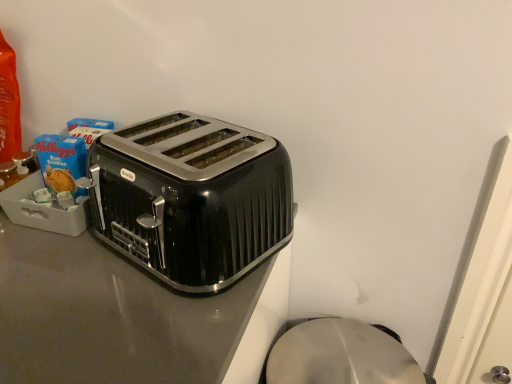
Question: Is black glossy toaster at center surrounding black metallic toaster at center?

Choices:
 (A) yes
 (B) no

Answer: (B)

Question: Is black glossy toaster at center in contact with black metallic toaster at center?

Choices:
 (A) yes
 (B) no

Answer: (B)

Question: Is black glossy toaster at center shorter than black metallic toaster at center?

Choices:
 (A) yes
 (B) no

Answer: (B)

Question: Does black glossy toaster at center come in front of black metallic toaster at center?

Choices:
 (A) yes
 (B) no

Answer: (A)

Question: From a real-world perspective, is black glossy toaster at center positioned under black metallic toaster at center based on gravity?

Choices:
 (A) no
 (B) yes

Answer: (B)

Question: From the image's perspective, does black glossy toaster at center appear lower than black metallic toaster at center?

Choices:
 (A) yes
 (B) no

Answer: (A)

Question: From the image's perspective, would you say black metallic toaster at center is shown under black glossy toaster at center?

Choices:
 (A) no
 (B) yes

Answer: (A)

Question: Is black metallic toaster at center in front of black glossy toaster at center?

Choices:
 (A) yes
 (B) no

Answer: (B)

Question: Does black metallic toaster at center have a lesser height compared to black glossy toaster at center?

Choices:
 (A) yes
 (B) no

Answer: (A)

Question: Are black metallic toaster at center and black glossy toaster at center located far from each other?

Choices:
 (A) no
 (B) yes

Answer: (A)

Question: Does black metallic toaster at center have a smaller size compared to black glossy toaster at center?

Choices:
 (A) yes
 (B) no

Answer: (A)

Question: Is black metallic toaster at center further to the viewer compared to black glossy toaster at center?

Choices:
 (A) no
 (B) yes

Answer: (B)

Question: Choose the correct answer: Is black glossy toaster at center inside black metallic toaster at center or outside it?

Choices:
 (A) inside
 (B) outside

Answer: (B)